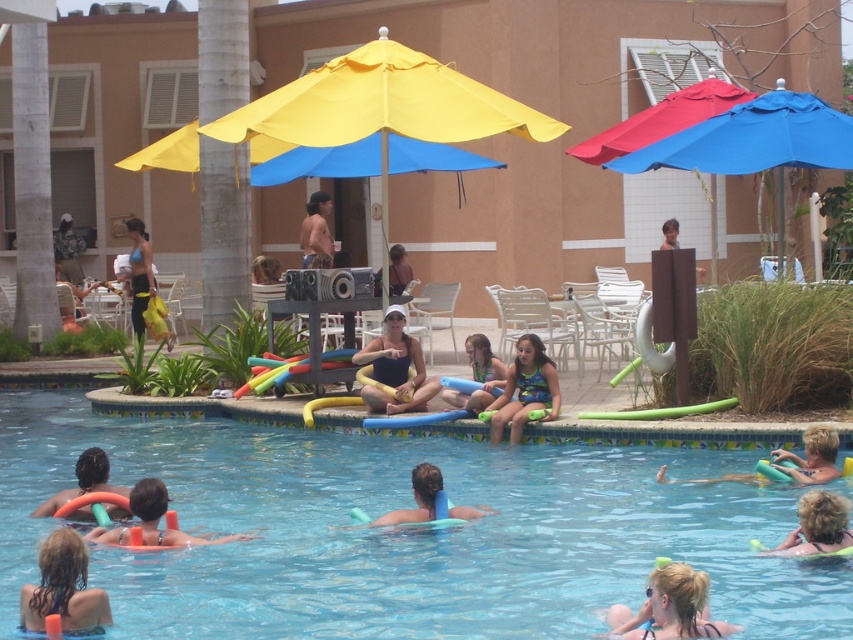
In the scene shown: You are a swimmer who wants to ensure safety while in the pool. You see the matte orange float at lower left and the smooth brown wooden post at upper center. Which object is higher above the water level?

The matte orange float at lower left is much taller than the smooth brown wooden post at upper center, so the matte orange float at lower left is higher above the water level.

You are a lifeguard on duty and need to retrieve an object from the poolside. You are currently standing at the lifeguard chair located between the multicolored swimsuit at poolside and the orange foam ring at lower left. Which object is closer to your current position?

The orange foam ring at lower left is closer to your current position since the distance between the multicolored swimsuit at poolside and the orange foam ring at lower left is 4.86 meters, so the midpoint would be approximately 2.43 meters from each object. However, without knowing the exact position of the lifeguard chair, it is impossible to determine which object is closer. Please provide more information about the lifeguard chair location.

In the scene shown: You are a photographer standing at the edge of the pool. You want to take a photo that includes both the dark brown hair at lower left and the matte blue swimsuit at center. Which object should you focus on first to ensure both are in clear view?

The dark brown hair at lower left is closer to the viewer than the matte blue swimsuit at center. To ensure both are in clear view, focus on the dark brown hair at lower left first since it is nearer, and the depth of field will likely keep the matte blue swimsuit at center in focus as well.